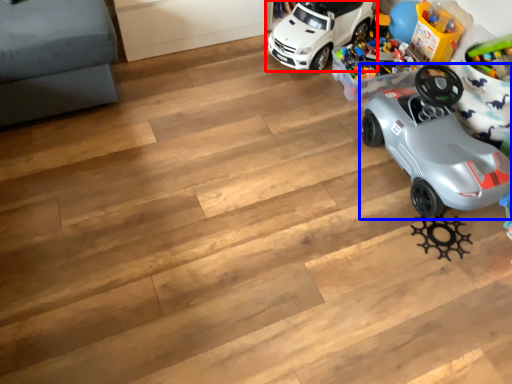
Question: Among these objects, which one is farthest to the camera, car (highlighted by a red box) or car (highlighted by a blue box)?

Choices:
 (A) car
 (B) car

Answer: (A)